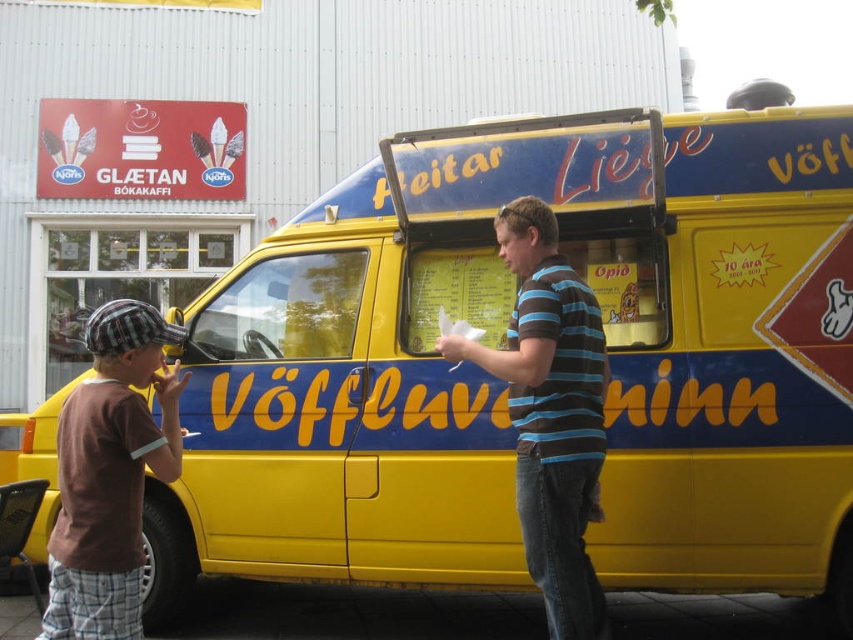
You are a customer waiting in line at the GLAETAN BOKAKAFFI food truck. You notice two people ahead of you. The first person is wearing a brown cotton shirt at left, and the second person is wearing a striped cotton shirt at center. When you look at the two shirts from your position in the line, which shirt is closer to the food truck?

The striped cotton shirt at center is to the right of the brown cotton shirt at left. Since the brown cotton shirt at left is positioned to the left of the striped cotton shirt at center, the brown cotton shirt at left is closer to the food truck compared to the striped cotton shirt at center.